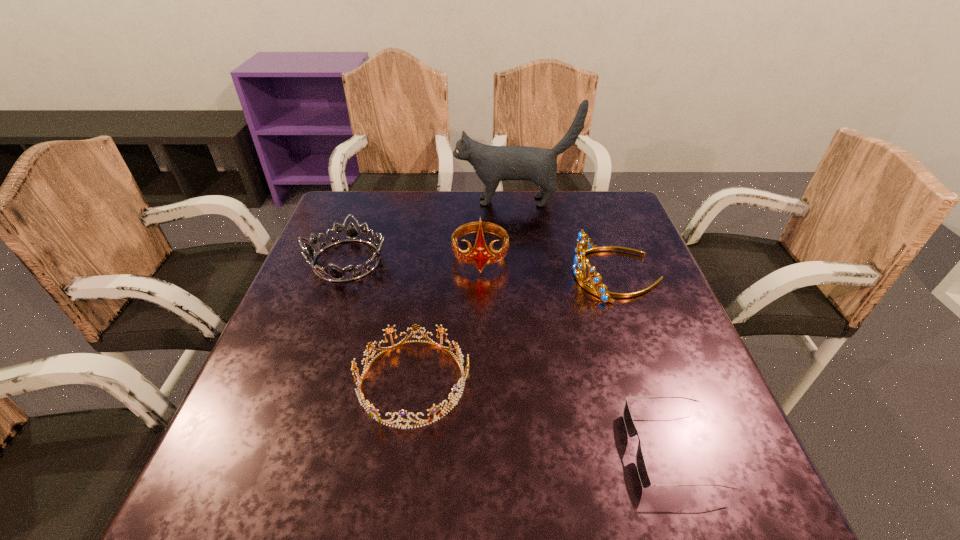
This screenshot has width=960, height=540. In order to click on vacant region that satisfies the following two spatial constraints: 1. at the face of the cat; 2. on the front-facing side of the tallest tiara in this screenshot , I will do `click(520, 258)`.